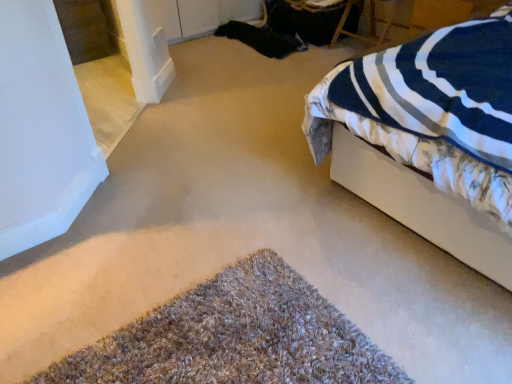
This screenshot has width=512, height=384. I want to click on free space to the back side of brown shaggy carpet at lower center, so click(x=214, y=222).